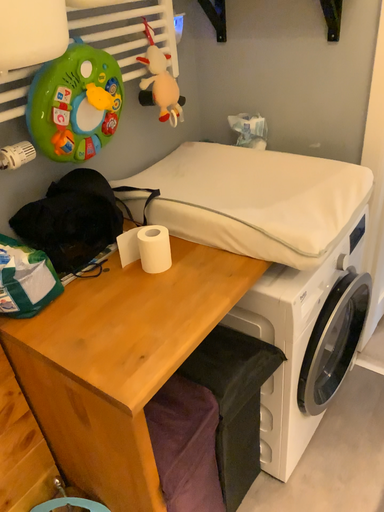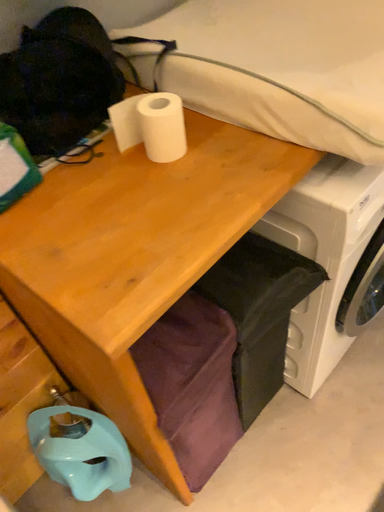
Question: How did the camera likely rotate when shooting the video?

Choices:
 (A) rotated upward
 (B) rotated downward

Answer: (B)